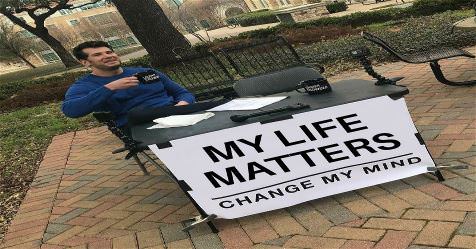
You are a GUI agent. You are given a task and a screenshot of the screen. Output one action in this format:
    pyautogui.click(x=<x>, y=<y>)
    Task: Click on the brick floor
    This screenshot has width=476, height=249.
    Given the screenshot: What is the action you would take?
    pyautogui.click(x=99, y=217)